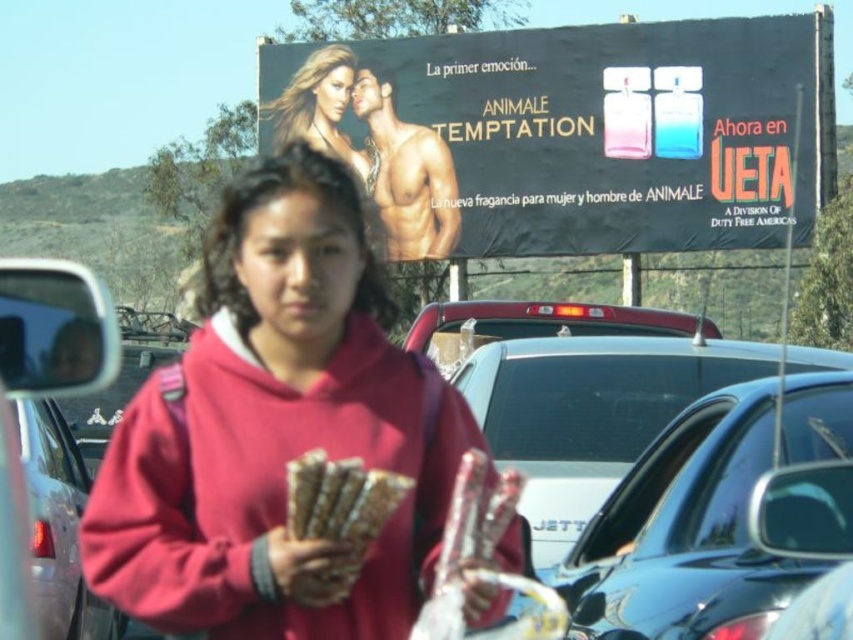
Question: Can you confirm if black glossy billboard at upper center is smaller than metallic silver car at left?

Choices:
 (A) yes
 (B) no

Answer: (B)

Question: Which point is farther to the camera?

Choices:
 (A) (665, 579)
 (B) (15, 593)
 (C) (296, 588)
 (D) (335, 436)

Answer: (D)

Question: Is metallic silver car at left above brown textured sticks at center?

Choices:
 (A) yes
 (B) no

Answer: (B)

Question: Is metallic silver sedan at center below golden textured sticks at center?

Choices:
 (A) yes
 (B) no

Answer: (B)

Question: Which object is positioned closest to the metallic silver sedan at center?

Choices:
 (A) matte pink hoodie at center
 (B) metallic silver car at left
 (C) brown textured sticks at center
 (D) shiny black sedan at right

Answer: (B)

Question: Among these points, which one is nearest to the camera?

Choices:
 (A) (299, 598)
 (B) (427, 74)
 (C) (53, 538)
 (D) (341, 440)

Answer: (A)